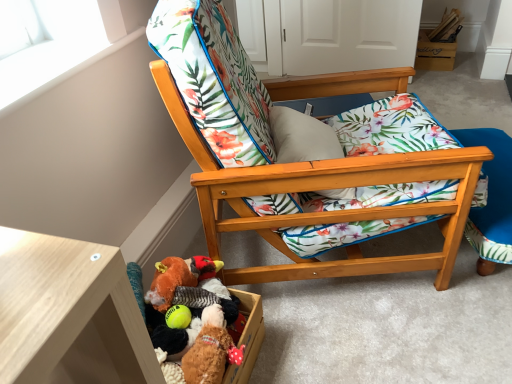
Question: Considering the relative sizes of wooden chair with floral cushion at center and white matte window screen at upper left in the image provided, is wooden chair with floral cushion at center wider than white matte window screen at upper left?

Choices:
 (A) no
 (B) yes

Answer: (B)

Question: Can you confirm if wooden chair with floral cushion at center is positioned to the right of white matte window screen at upper left?

Choices:
 (A) yes
 (B) no

Answer: (A)

Question: Can you confirm if wooden chair with floral cushion at center is bigger than white matte window screen at upper left?

Choices:
 (A) no
 (B) yes

Answer: (B)

Question: Is wooden chair with floral cushion at center looking in the opposite direction of white matte window screen at upper left?

Choices:
 (A) yes
 (B) no

Answer: (A)

Question: From a real-world perspective, is wooden chair with floral cushion at center under white matte window screen at upper left?

Choices:
 (A) no
 (B) yes

Answer: (B)

Question: In terms of width, does wooden box at upper right look wider or thinner when compared to white matte window screen at upper left?

Choices:
 (A) thin
 (B) wide

Answer: (B)

Question: From a real-world perspective, is wooden box at upper right above or below white matte window screen at upper left?

Choices:
 (A) below
 (B) above

Answer: (A)

Question: Considering their positions, is wooden box at upper right located in front of or behind white matte window screen at upper left?

Choices:
 (A) front
 (B) behind

Answer: (B)

Question: Based on their sizes in the image, would you say wooden box at upper right is bigger or smaller than white matte window screen at upper left?

Choices:
 (A) big
 (B) small

Answer: (A)

Question: In terms of size, does fluffy fabric stuffed animal at lower left, the 2th toy viewed from the front, appear bigger or smaller than wooden chair with floral cushion at center?

Choices:
 (A) small
 (B) big

Answer: (A)

Question: Considering their positions, is fluffy fabric stuffed animal at lower left, the 2th toy viewed from the front, located in front of or behind wooden chair with floral cushion at center?

Choices:
 (A) front
 (B) behind

Answer: (B)

Question: From the image's perspective, is fluffy fabric stuffed animal at lower left, positioned as the first toy in back-to-front order, above or below wooden chair with floral cushion at center?

Choices:
 (A) above
 (B) below

Answer: (B)

Question: Based on their positions, is fluffy fabric stuffed animal at lower left, the 2th toy viewed from the front, located to the left or right of wooden chair with floral cushion at center?

Choices:
 (A) left
 (B) right

Answer: (A)

Question: Is wooden folding chair at lower right wider or thinner than fluffy brown teddy bear at lower center, the 1th toy viewed from the front?

Choices:
 (A) wide
 (B) thin

Answer: (A)

Question: Considering the positions of wooden folding chair at lower right and fluffy brown teddy bear at lower center, the 1th toy viewed from the front, in the image, is wooden folding chair at lower right taller or shorter than fluffy brown teddy bear at lower center, the 1th toy viewed from the front,?

Choices:
 (A) tall
 (B) short

Answer: (A)